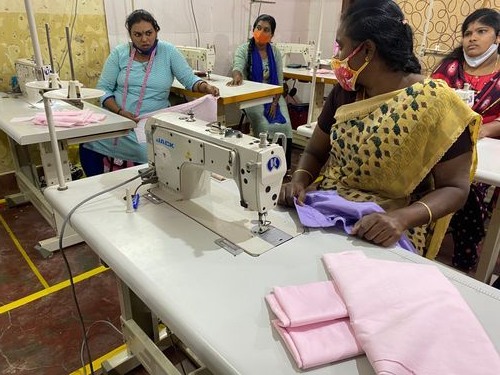
Locate an element on the screen. The image size is (500, 375). sewing machines is located at coordinates (233, 157), (24, 64), (206, 54), (299, 47), (462, 90).